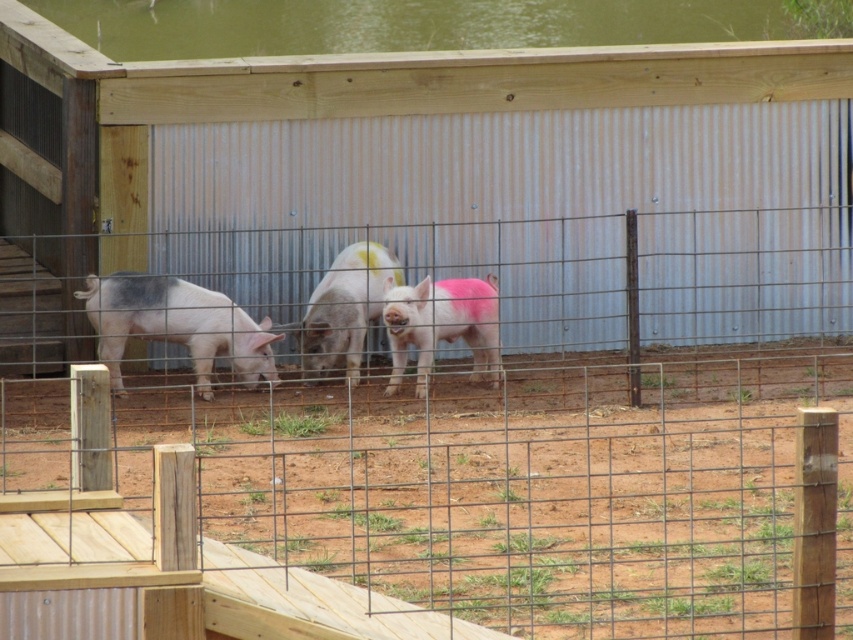
Which is above, green water at upper center or pink matte pig at center?

green water at upper center is above.

Can you confirm if green water at upper center is taller than pink matte pig at center?

No, green water at upper center is not taller than pink matte pig at center.

Where is `green water at upper center`? Image resolution: width=853 pixels, height=640 pixels. green water at upper center is located at coordinates (425, 22).

Does green water at upper center have a greater height compared to gray matte pig at center?

Incorrect, green water at upper center's height is not larger of gray matte pig at center's.

Is green water at upper center to the left of gray matte pig at center from the viewer's perspective?

Yes, green water at upper center is to the left of gray matte pig at center.

Does point (282, 12) lie in front of point (231, 321)?

No.

At what (x,y) coordinates should I click in order to perform the action: click on green water at upper center. Please return your answer as a coordinate pair (x, y). This screenshot has height=640, width=853. Looking at the image, I should click on (425, 22).

Measure the distance between green water at upper center and camera.

green water at upper center is 22.83 meters from camera.

Who is shorter, green water at upper center or pink matte piglet at center?

With less height is green water at upper center.

Which is behind, point (231, 10) or point (405, 308)?

The point (231, 10) is more distant.

The height and width of the screenshot is (640, 853). In order to click on green water at upper center in this screenshot , I will do `click(425, 22)`.